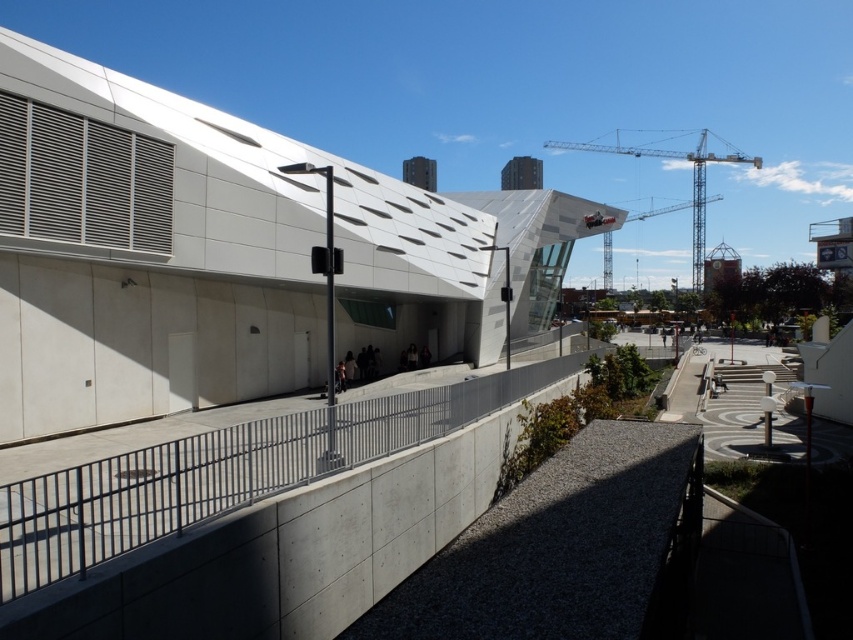
You are standing at the entrance of the building and want to reach the metallic gray crane at upper right. Which direction should you move relative to the gray metallic rail at center?

The gray metallic rail at center is to the left of the metallic gray crane at upper right, so you should move to the right of the gray metallic rail at center to reach the crane.

You are standing in front of the building and want to take a photo of both the gray metallic rail at center and the metallic gray crane at upper right. Which object should you adjust your camera focus on first to ensure both are in the frame?

You should focus on the gray metallic rail at center first since it is closer to the viewer than the metallic gray crane at upper right, allowing both to be in the frame when adjusting the camera.

You are a delivery drone operator. Your drone has a maximum flight range of 500 feet. You need to deliver a package from the gray metallic rail at center to the metallic gray crane at upper right. Can your drone complete the delivery without needing to recharge?

The distance between the gray metallic rail at center and the metallic gray crane at upper right is 456.95 feet, which is within the drone operator stated maximum flight range of 500 feet. The drone can complete the delivery without needing to recharge.